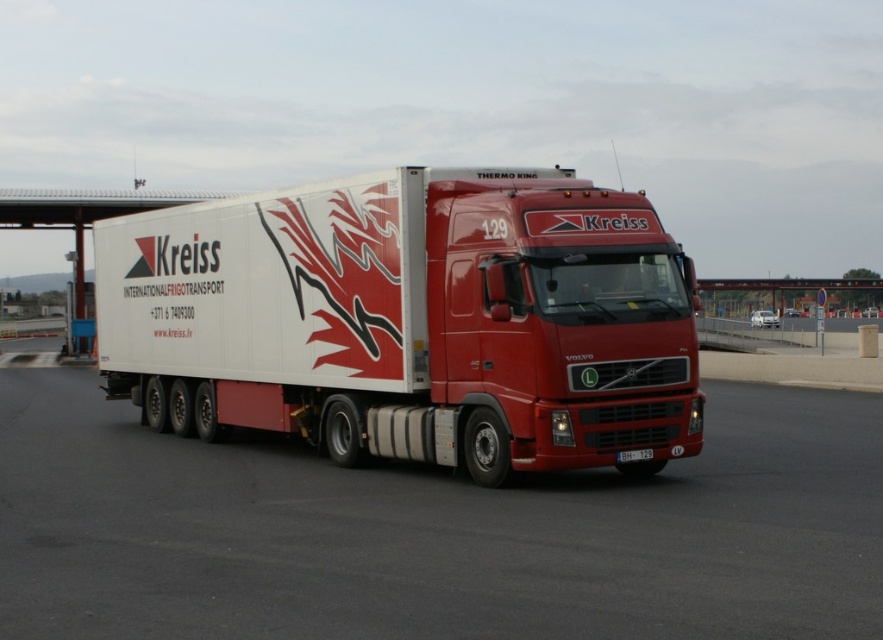
Question: Can you confirm if white glossy trailer at center is wider than black plastic license plate at center?

Choices:
 (A) yes
 (B) no

Answer: (A)

Question: Can you confirm if white glossy truck at center is positioned to the right of black plastic license plate at center?

Choices:
 (A) yes
 (B) no

Answer: (B)

Question: Which object appears closest to the camera in this image?

Choices:
 (A) white glossy trailer at center
 (B) black plastic license plate at center

Answer: (A)

Question: Where is white glossy truck at center located in relation to black plastic license plate at center in the image?

Choices:
 (A) right
 (B) left

Answer: (B)

Question: Which object appears closest to the camera in this image?

Choices:
 (A) white glossy trailer at center
 (B) black plastic license plate at center
 (C) white glossy truck at center

Answer: (C)

Question: Which object appears farthest from the camera in this image?

Choices:
 (A) white glossy truck at center
 (B) black plastic license plate at center

Answer: (B)